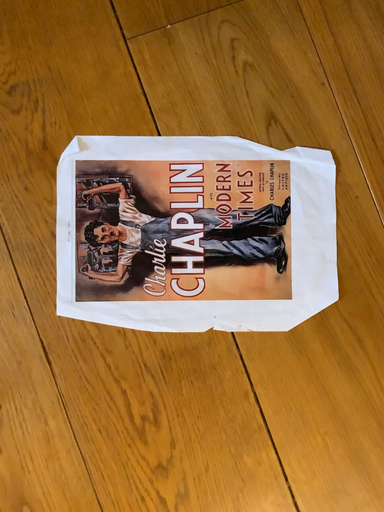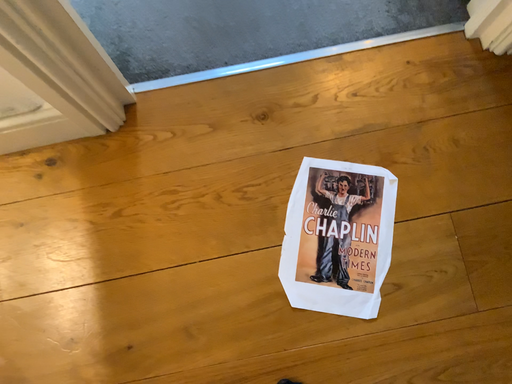
Question: How did the camera likely rotate when shooting the video?

Choices:
 (A) rotated downward
 (B) rotated upward

Answer: (B)